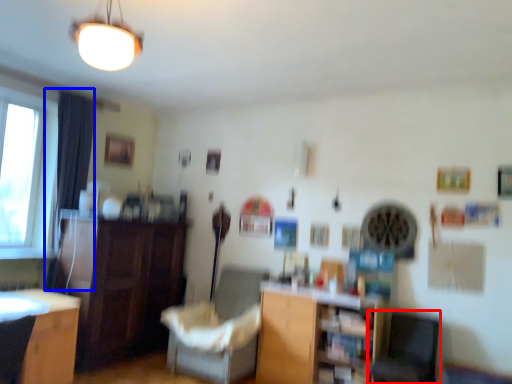
Question: Which of the following is the farthest to the observer, swivel chair (highlighted by a red box) or curtain (highlighted by a blue box)?

Choices:
 (A) swivel chair
 (B) curtain

Answer: (B)